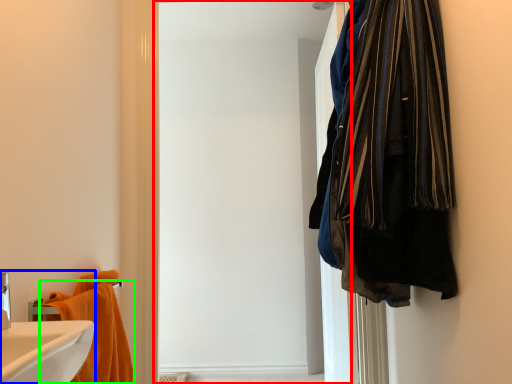
Question: Which object is positioned farthest from screen door (highlighted by a red box)? Select from bathroom cabinet (highlighted by a blue box) and towel (highlighted by a green box).

Choices:
 (A) bathroom cabinet
 (B) towel

Answer: (A)